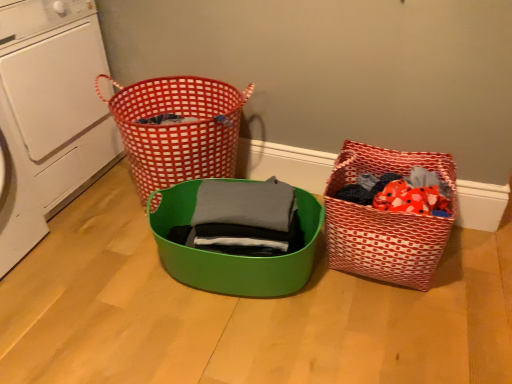
Find the location of a particular element. The image size is (512, 384). free location to the left of red checkered basket at upper left is located at coordinates (95, 206).